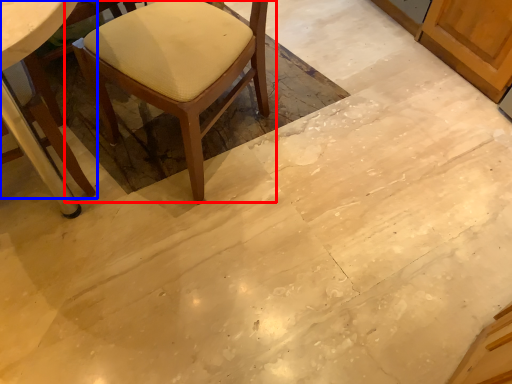
Question: Which point is closer to the camera, chair (highlighted by a red box) or chair (highlighted by a blue box)?

Choices:
 (A) chair
 (B) chair

Answer: (B)